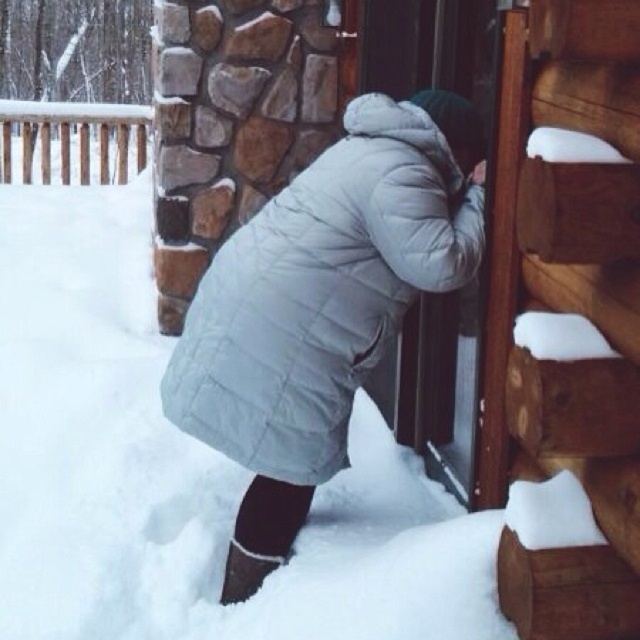
Is point (262, 292) positioned in front of point (96, 140)?

Yes.

Does white quilted jacket at center have a lesser width compared to white wooden railing at upper left?

Yes.

Between point (243, 257) and point (68, 108), which one is positioned behind?

Positioned behind is point (68, 108).

Identify the location of white quilted jacket at center. (321, 292).